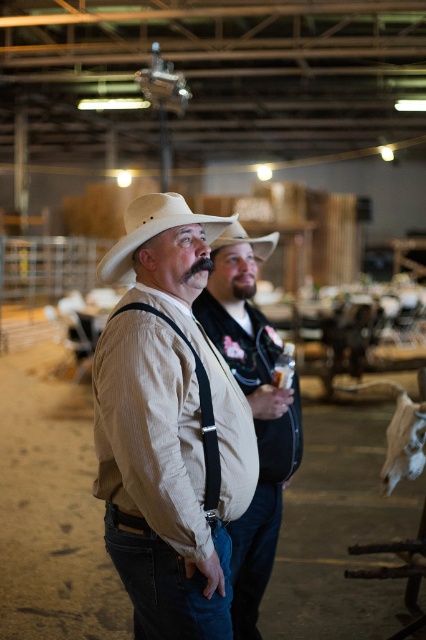
Question: Is matte beige shirt at center above beige felt cowboy hat at center?

Choices:
 (A) yes
 (B) no

Answer: (B)

Question: Which point is farther from the camera taking this photo?

Choices:
 (A) (184, 419)
 (B) (146, 204)

Answer: (B)

Question: Which object is positioned farthest from the beige felt cowboy hat at center?

Choices:
 (A) white matte cowboy hat at center
 (B) matte beige shirt at center

Answer: (B)

Question: Considering the real-world distances, which object is farthest from the tan corduroy shirt at center?

Choices:
 (A) matte beige shirt at center
 (B) white matte cowboy hat at center

Answer: (B)

Question: Is tan corduroy shirt at center further to camera compared to matte beige shirt at center?

Choices:
 (A) no
 (B) yes

Answer: (A)

Question: Does tan corduroy shirt at center have a greater width compared to white matte cowboy hat at center?

Choices:
 (A) no
 (B) yes

Answer: (B)